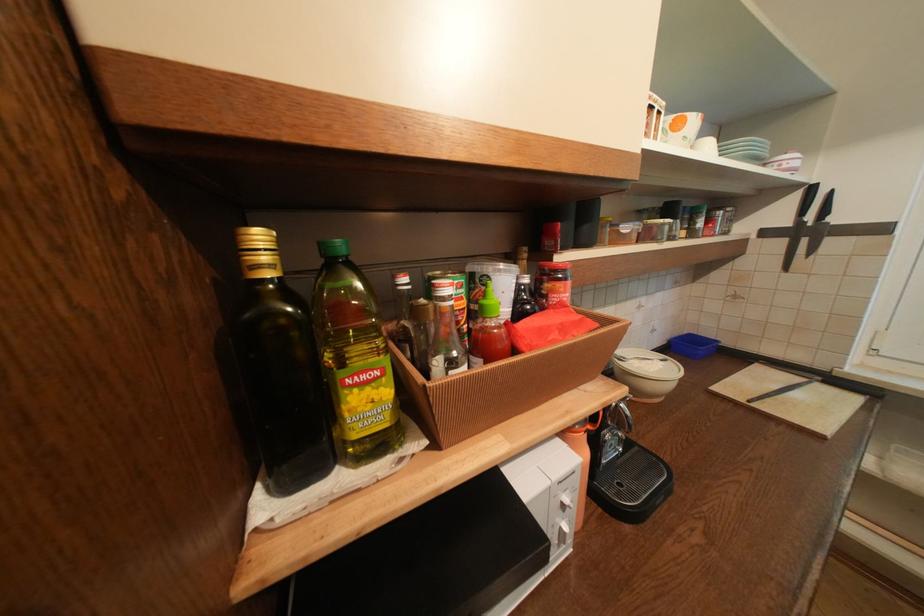
Where would you lift the beige bowl lid? Please return your answer as a coordinate pair (x, y).

(646, 373)